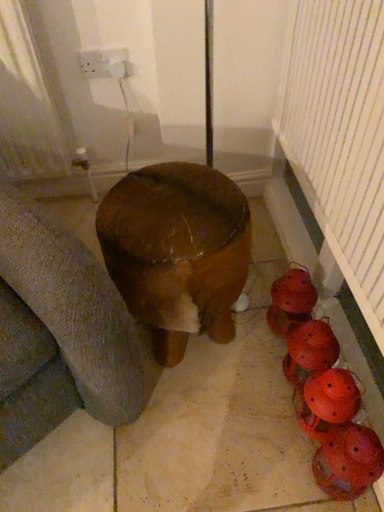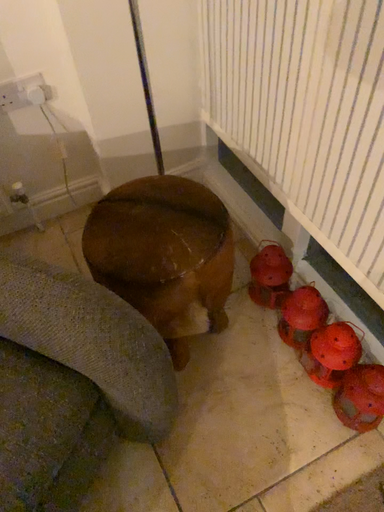
Question: How did the camera likely rotate when shooting the video?

Choices:
 (A) rotated left
 (B) rotated right

Answer: (B)